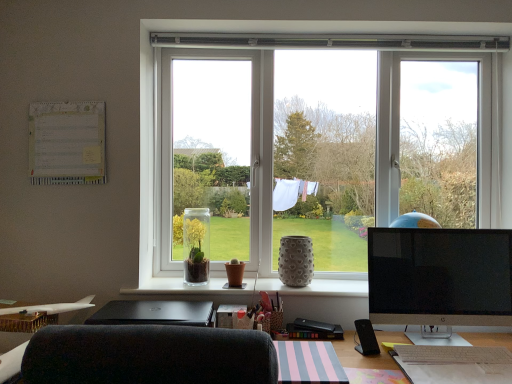
You are a GUI agent. You are given a task and a screenshot of the screen. Output one action in this format:
    pyautogui.click(x=<x>, y=<y>)
    Task: Click on the empty space that is ontop of white plastic keyboard at lower right (from a real-world perspective)
    
    Given the screenshot: What is the action you would take?
    pyautogui.click(x=459, y=354)